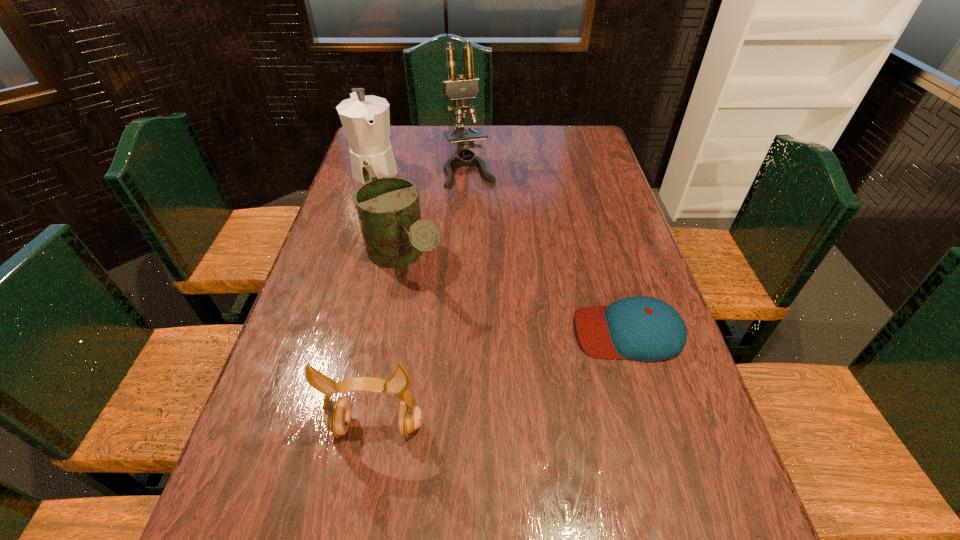
You are a GUI agent. You are given a task and a screenshot of the screen. Output one action in this format:
    pyautogui.click(x=<x>, y=<y>)
    Task: Click on the vacant space located with the spout on the watering can
    This screenshot has height=540, width=960.
    Given the screenshot: What is the action you would take?
    pyautogui.click(x=492, y=397)

At what (x,y) coordinates should I click in order to perform the action: click on free spot located 0.180m with the spout on the watering can. Please return your answer as a coordinate pair (x, y). The width and height of the screenshot is (960, 540). Looking at the image, I should click on (457, 348).

Locate an element on the screen. Image resolution: width=960 pixels, height=540 pixels. free point located at the spout of the second tallest object is located at coordinates (396, 217).

Locate an element on the screen. vacant point located at the spout of the second tallest object is located at coordinates (390, 207).

Identify the location of vacant space located at the spout of the second tallest object. This screenshot has height=540, width=960. (400, 228).

You are a GUI agent. You are given a task and a screenshot of the screen. Output one action in this format:
    pyautogui.click(x=<x>, y=<y>)
    Task: Click on the vacant space located 0.220m at the eyepieces of the microscope
    Image resolution: width=960 pixels, height=540 pixels.
    Given the screenshot: What is the action you would take?
    pyautogui.click(x=491, y=229)

The width and height of the screenshot is (960, 540). In order to click on vacant space located 0.270m at the eyepieces of the microscope in this screenshot , I will do `click(494, 239)`.

Locate an element on the screen. The height and width of the screenshot is (540, 960). free space located at the eyepieces of the microscope is located at coordinates pyautogui.click(x=495, y=244).

Where is `coffeepot positioned at the far edge`? The height and width of the screenshot is (540, 960). coffeepot positioned at the far edge is located at coordinates (366, 119).

At what (x,y) coordinates should I click in order to perform the action: click on microscope located in the far edge section of the desktop. Please return your answer as a coordinate pair (x, y). Image resolution: width=960 pixels, height=540 pixels. Looking at the image, I should click on (458, 89).